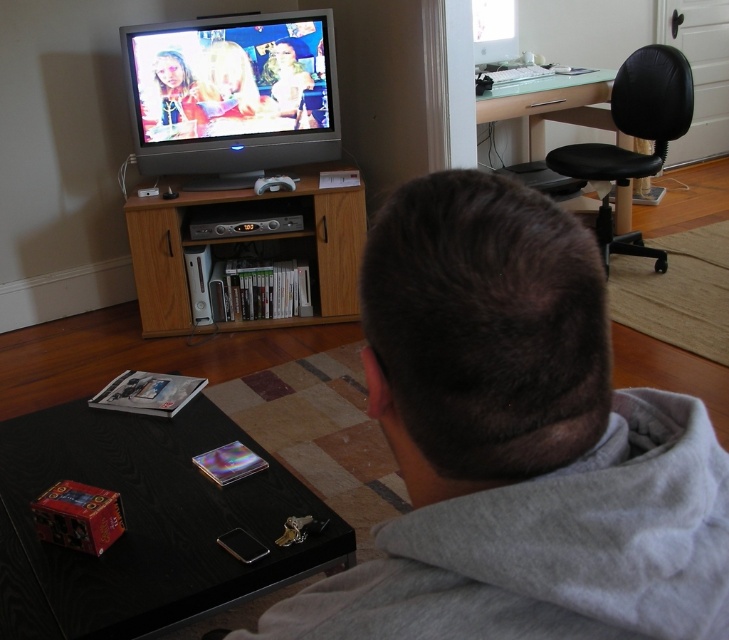
Question: From the image, what is the correct spatial relationship of wooden entertainment center at center in relation to black leather swivel chair at upper right?

Choices:
 (A) below
 (B) above

Answer: (A)

Question: Considering the real-world distances, which object is farthest from the black leather swivel chair at upper right?

Choices:
 (A) wooden entertainment center at center
 (B) gray cotton hoodie at upper center

Answer: (B)

Question: Based on their relative distances, which object is farther from the wooden entertainment center at center?

Choices:
 (A) black leather swivel chair at upper right
 (B) gray cotton hoodie at upper center

Answer: (B)

Question: Considering the relative positions of gray cotton hoodie at upper center and wooden entertainment center at center in the image provided, where is gray cotton hoodie at upper center located with respect to wooden entertainment center at center?

Choices:
 (A) right
 (B) left

Answer: (A)

Question: Can you confirm if gray cotton hoodie at upper center is wider than wooden entertainment center at center?

Choices:
 (A) no
 (B) yes

Answer: (A)

Question: Among these points, which one is nearest to the camera?

Choices:
 (A) (418, 177)
 (B) (615, 156)
 (C) (276, 195)

Answer: (A)